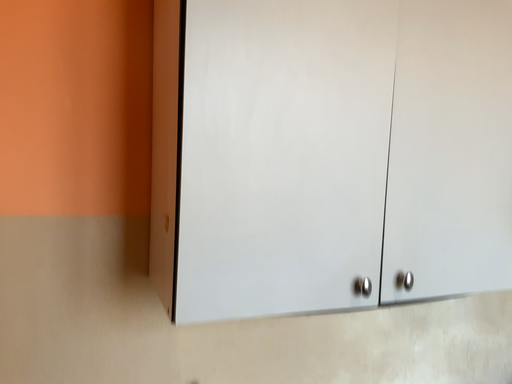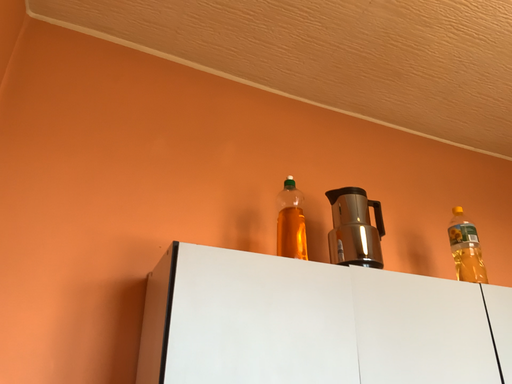
Question: Which way did the camera rotate in the video?

Choices:
 (A) rotated upward
 (B) rotated downward

Answer: (A)